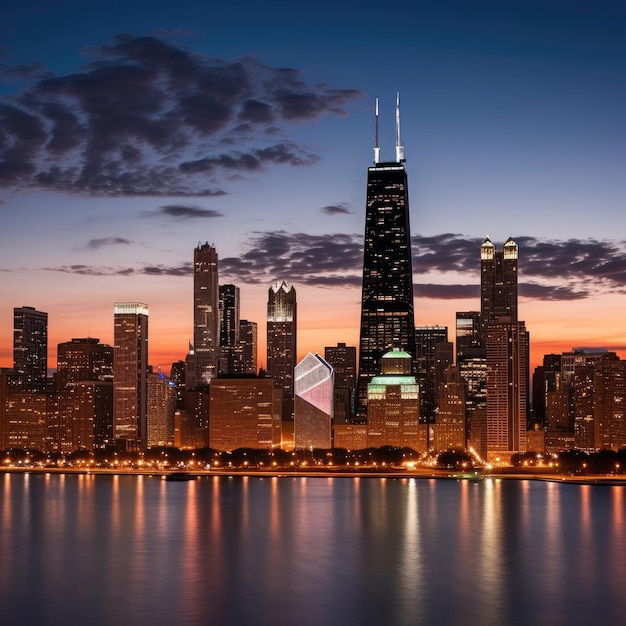
The width and height of the screenshot is (626, 626). I want to click on light reflections, so click(x=140, y=494), click(x=191, y=506), click(x=274, y=493), click(x=409, y=503), click(x=495, y=498), click(x=466, y=496), click(x=357, y=486), click(x=216, y=491), click(x=120, y=488), click(x=86, y=480).